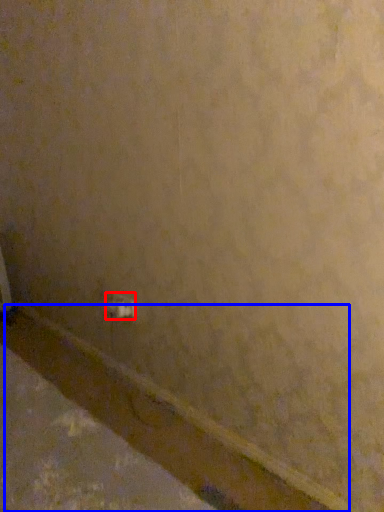
Question: Among these objects, which one is farthest to the camera, power plugs and sockets (highlighted by a red box) or molding (highlighted by a blue box)?

Choices:
 (A) power plugs and sockets
 (B) molding

Answer: (A)